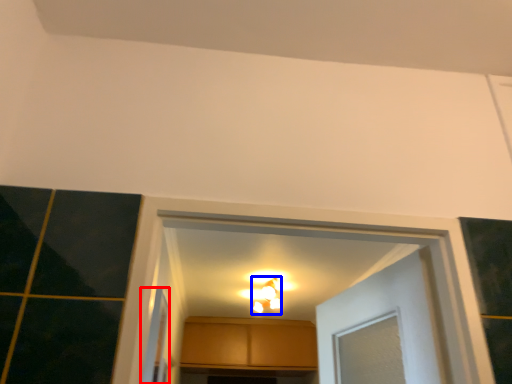
Question: Which of the following is the closest to the observer, screen door (highlighted by a red box) or light fixture (highlighted by a blue box)?

Choices:
 (A) screen door
 (B) light fixture

Answer: (A)